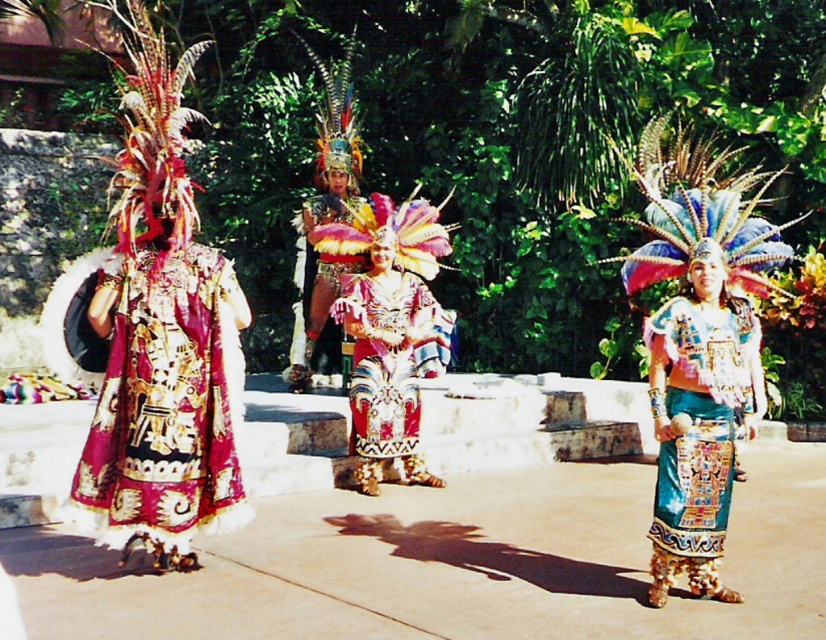
Question: Which object appears farthest from the camera in this image?

Choices:
 (A) shiny teal skirt at center
 (B) shiny metallic costume at center
 (C) rich velvet dress at left

Answer: (B)

Question: Which point is farther to the camera?

Choices:
 (A) rich velvet dress at left
 (B) shiny teal skirt at center
 (C) shiny metallic costume at center

Answer: (C)

Question: Which object appears farthest from the camera in this image?

Choices:
 (A) rich velvet dress at left
 (B) shiny teal skirt at center
 (C) shiny metallic costume at center

Answer: (C)

Question: Can you confirm if rich velvet dress at left is positioned below shiny teal skirt at center?

Choices:
 (A) yes
 (B) no

Answer: (B)

Question: Is rich velvet dress at left bigger than shiny teal skirt at center?

Choices:
 (A) yes
 (B) no

Answer: (A)

Question: Does rich velvet dress at left appear under shiny metallic costume at center?

Choices:
 (A) yes
 (B) no

Answer: (A)